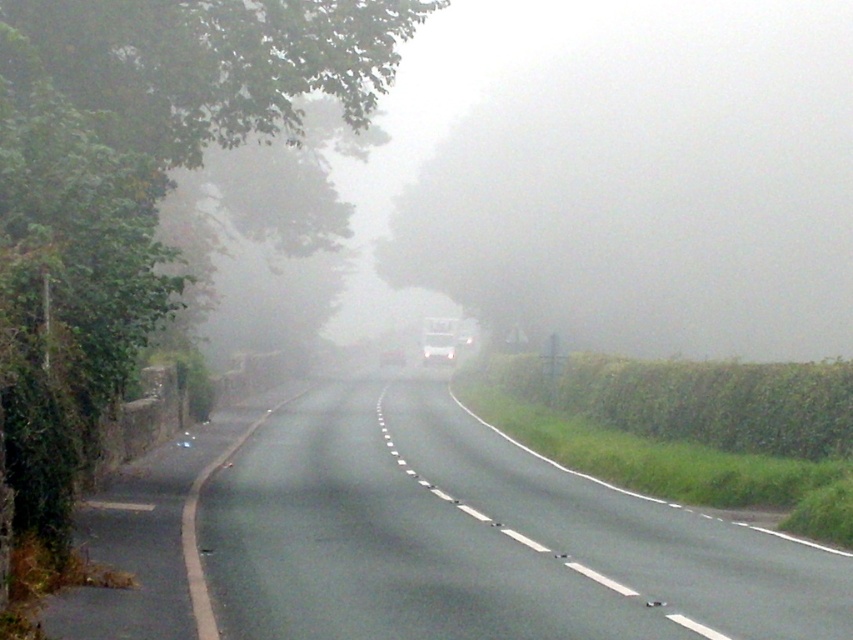
Question: Among these objects, which one is nearest to the camera?

Choices:
 (A) smooth asphalt road at center
 (B) black asphalt road at left

Answer: (B)

Question: Considering the relative positions of smooth asphalt road at center and black asphalt road at left in the image provided, where is smooth asphalt road at center located with respect to black asphalt road at left?

Choices:
 (A) left
 (B) right

Answer: (B)

Question: Can you confirm if smooth asphalt road at center is positioned to the left of black asphalt road at left?

Choices:
 (A) yes
 (B) no

Answer: (B)

Question: Is smooth asphalt road at center wider than black asphalt road at left?

Choices:
 (A) no
 (B) yes

Answer: (B)

Question: Which point appears closest to the camera in this image?

Choices:
 (A) (132, 515)
 (B) (355, 492)

Answer: (A)